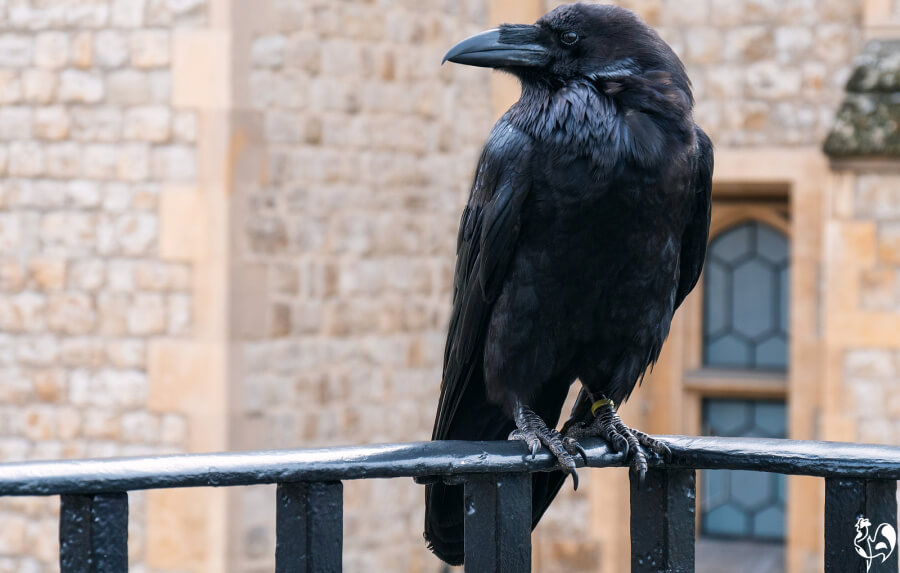
Where is `window frame`? This screenshot has height=573, width=900. window frame is located at coordinates (792, 174).